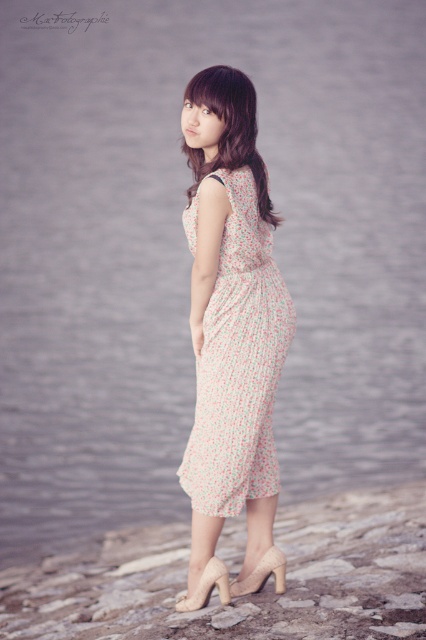
Question: From the image, what is the correct spatial relationship of floral chiffon dress at center in relation to beige suede high-heeled sandal at lower center?

Choices:
 (A) right
 (B) left

Answer: (A)

Question: Which of the following is the farthest from the observer?

Choices:
 (A) suede beige high-heeled shoe at lower center
 (B) floral chiffon dress at center
 (C) beige suede high-heeled sandal at lower center
 (D) floral fabric dress at center

Answer: (A)

Question: Is floral fabric dress at center wider than suede beige high-heeled shoe at lower center?

Choices:
 (A) yes
 (B) no

Answer: (A)

Question: Is beige suede high-heeled sandal at lower center thinner than suede beige high-heeled shoe at lower center?

Choices:
 (A) no
 (B) yes

Answer: (B)

Question: Which point is farther to the camera?

Choices:
 (A) suede beige high-heeled shoe at lower center
 (B) beige suede high-heeled sandal at lower center
 (C) floral chiffon dress at center
 (D) floral fabric dress at center

Answer: (A)

Question: Which object is the closest to the suede beige high-heeled shoe at lower center?

Choices:
 (A) floral fabric dress at center
 (B) floral chiffon dress at center
 (C) beige suede high-heeled sandal at lower center

Answer: (C)